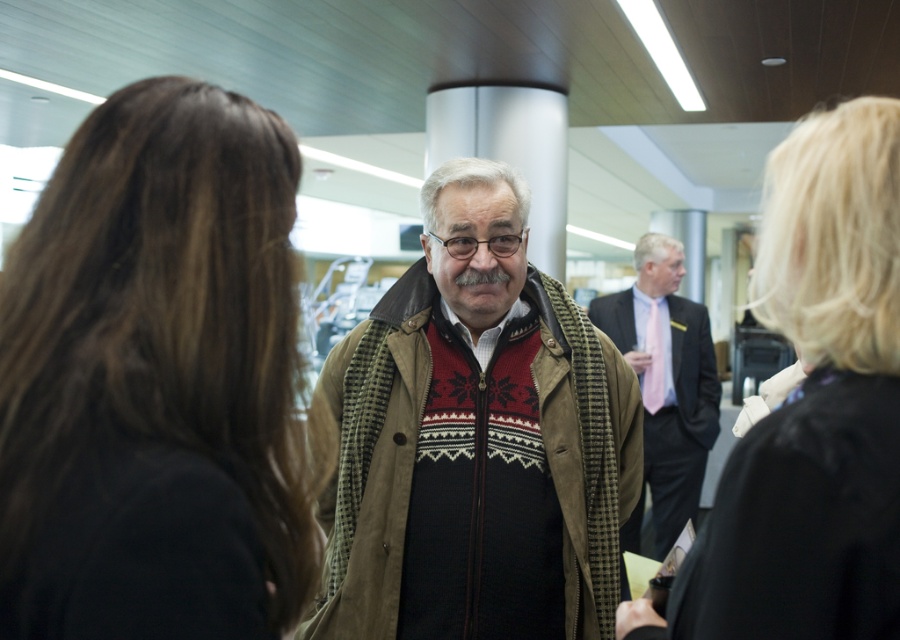
Question: Considering the relative positions of brown hair at upper left and dark suit at center in the image provided, where is brown hair at upper left located with respect to dark suit at center?

Choices:
 (A) above
 (B) below

Answer: (A)

Question: Which point is farther from the camera taking this photo?

Choices:
 (A) (817, 403)
 (B) (702, 353)

Answer: (B)

Question: Is knit sweater at center thinner than dark suit at center?

Choices:
 (A) no
 (B) yes

Answer: (A)

Question: Which object is closer to the camera taking this photo?

Choices:
 (A) knit sweater at center
 (B) black woolen jacket at lower right
 (C) black leather jacket at right

Answer: (C)

Question: Which object is positioned closest to the black leather jacket at right?

Choices:
 (A) brown hair at upper left
 (B) black woolen jacket at lower right

Answer: (B)

Question: Can you confirm if knit sweater at center is positioned below black woolen jacket at lower right?

Choices:
 (A) no
 (B) yes

Answer: (A)